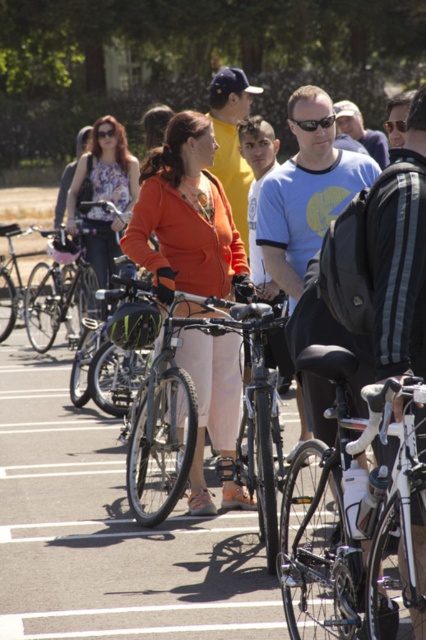
Question: In this image, where is matte floral dress at center located relative to green matte helmet at center?

Choices:
 (A) left
 (B) right

Answer: (A)

Question: Which object appears farthest from the camera in this image?

Choices:
 (A) matte floral dress at center
 (B) green matte helmet at center
 (C) shiny black bicycle at center
 (D) orange matte jacket at center

Answer: (A)

Question: Which point is closer to the camera?

Choices:
 (A) shiny black bicycle at center
 (B) matte floral dress at center
 (C) green matte helmet at center
 (D) orange matte jacket at center

Answer: (A)

Question: Which is farther from the matte floral dress at center?

Choices:
 (A) shiny silver bicycle at center
 (B) green matte helmet at center
 (C) orange matte jacket at center

Answer: (A)

Question: Is shiny black bicycle at center closer to camera compared to matte floral dress at center?

Choices:
 (A) no
 (B) yes

Answer: (B)

Question: Is shiny silver bicycle at center below matte floral dress at center?

Choices:
 (A) yes
 (B) no

Answer: (A)